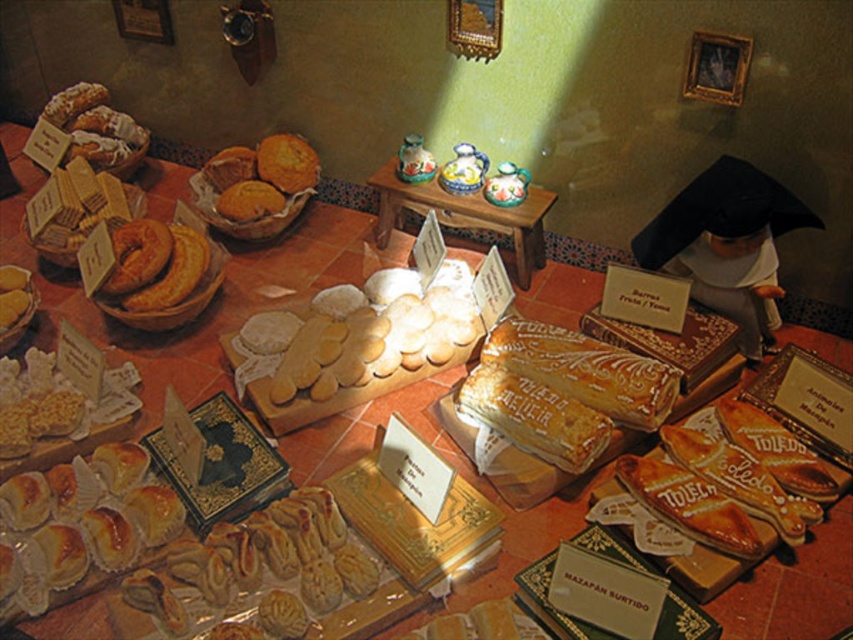
Does wooden table at center have a greater width compared to golden crumbly muffins at center?

Yes.

This screenshot has height=640, width=853. I want to click on wooden table at center, so click(x=465, y=214).

The height and width of the screenshot is (640, 853). I want to click on wooden table at center, so click(465, 214).